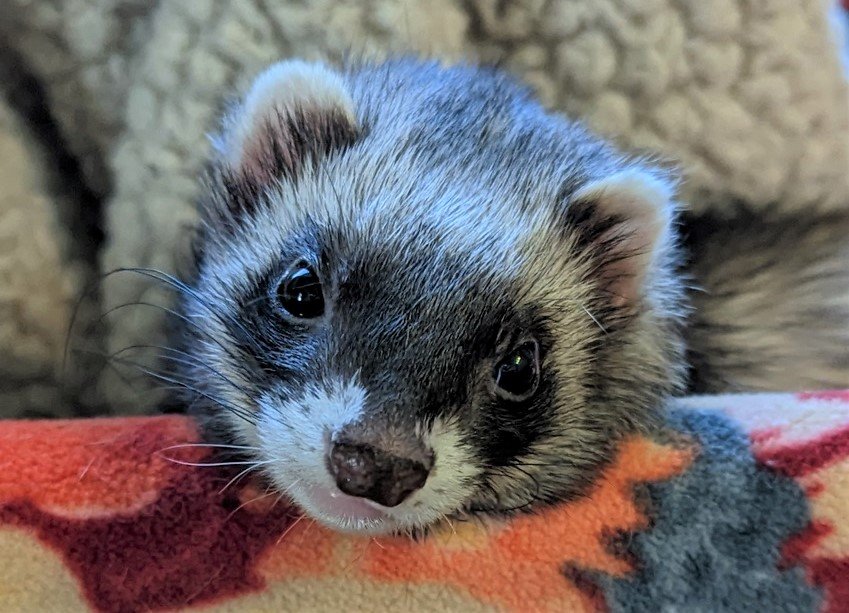
Identify the location of red coloring on blanket. Image resolution: width=849 pixels, height=613 pixels. (149, 539).